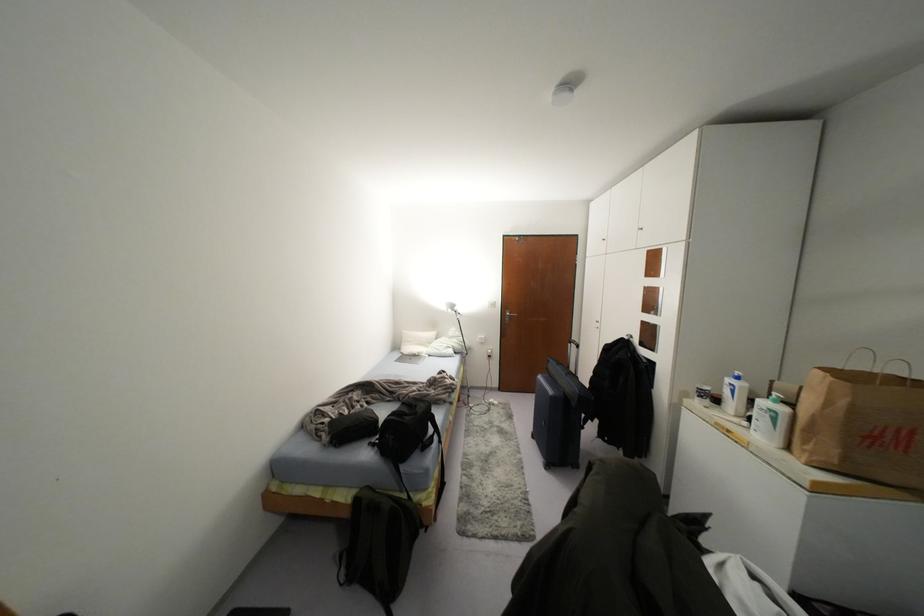
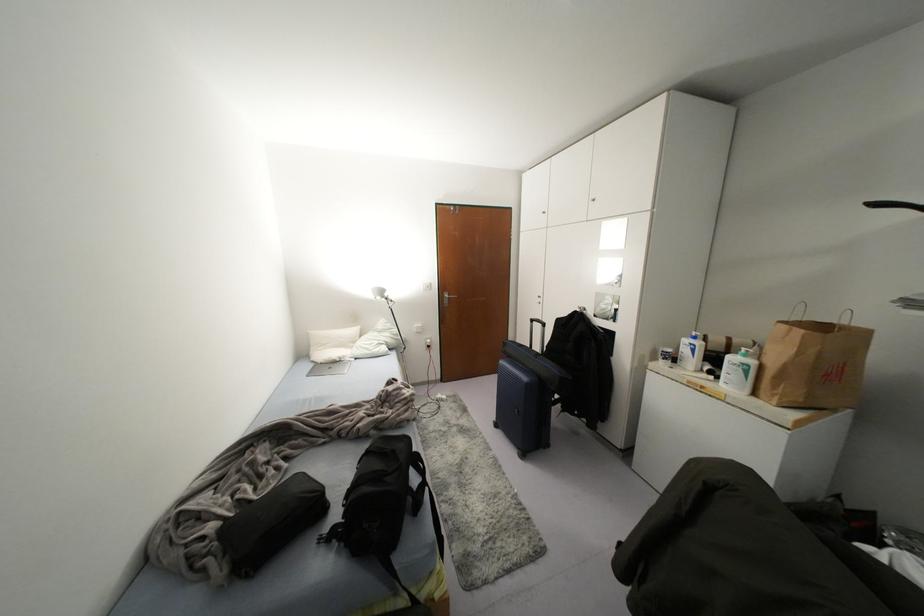
In the second image, find the point that corresponds to point (577, 346) in the first image.

(542, 323)